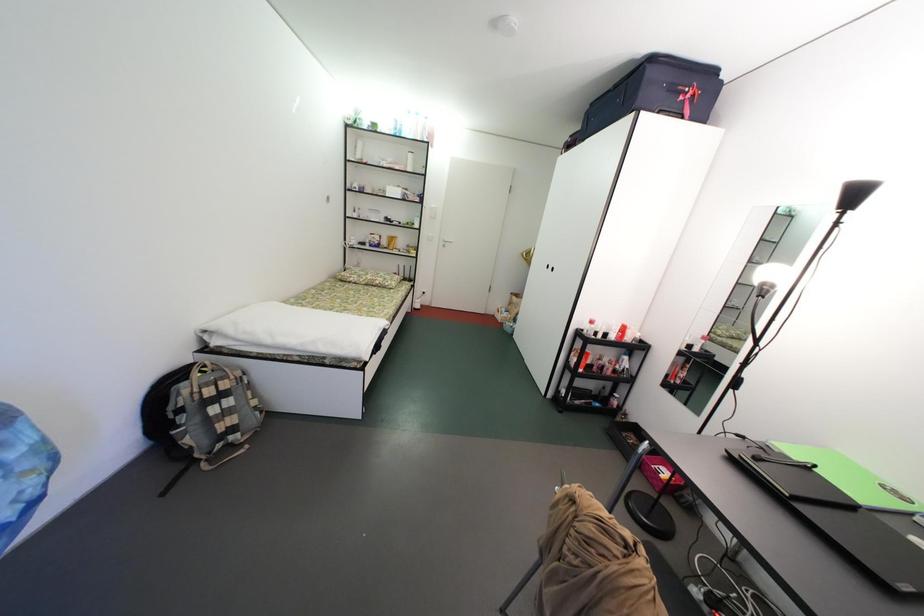
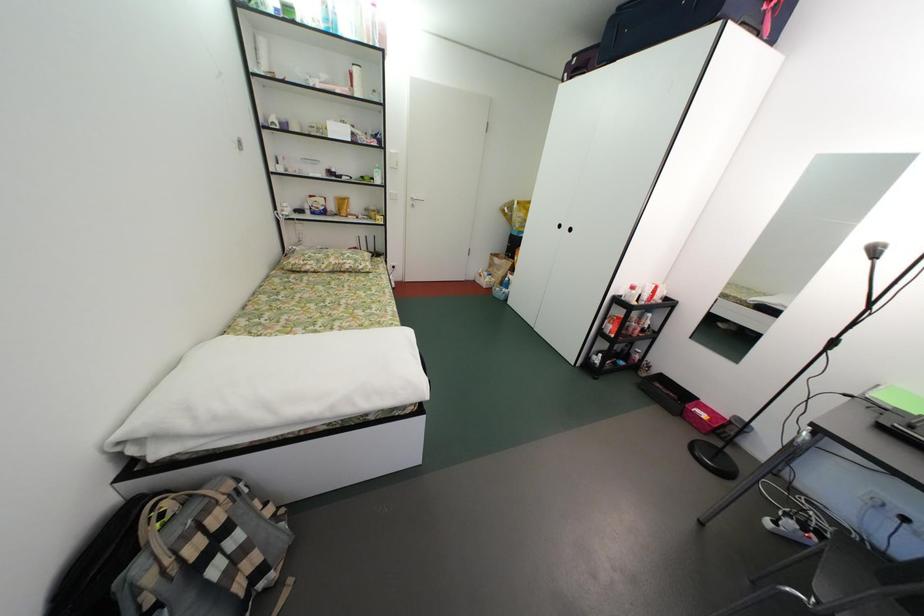
Question: The first image is from the beginning of the video and the second image is from the end. How did the camera likely rotate when shooting the video?

Choices:
 (A) Left
 (B) Right
 (C) Up
 (D) Down

Answer: (B)